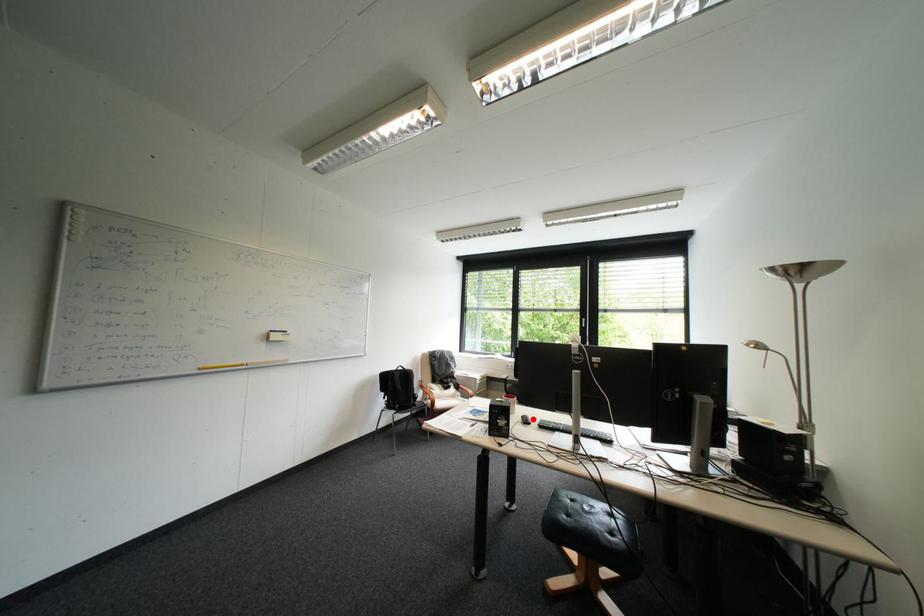
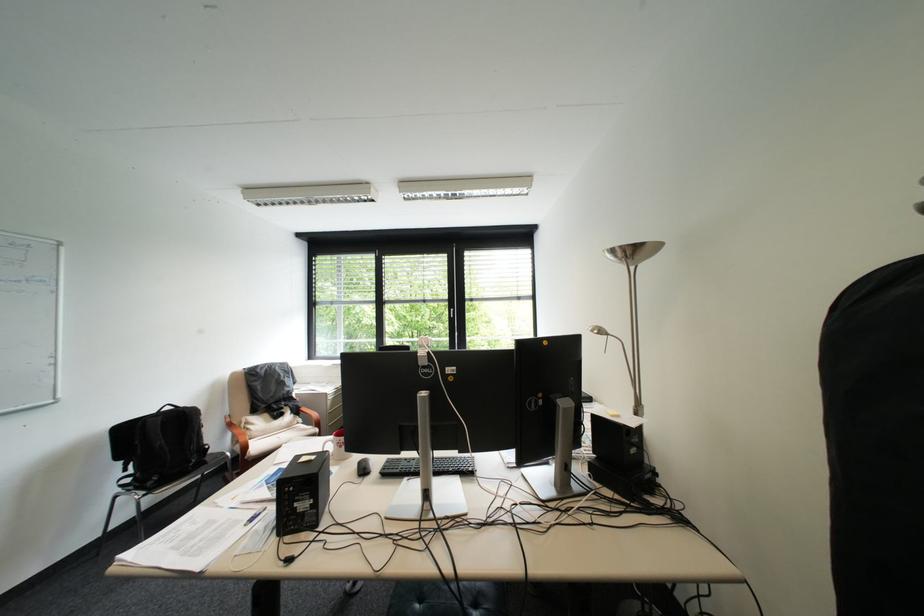
Where in the second image is the point corresponding to the highlighted location from the first image?

(369, 467)